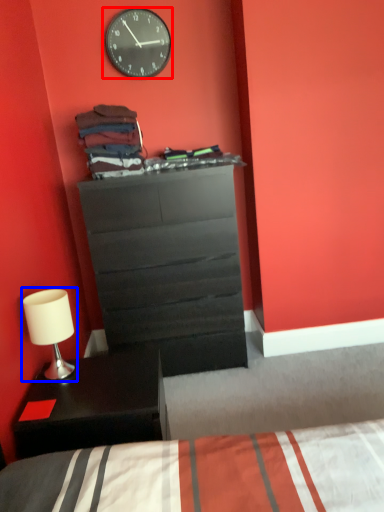
Question: Among these objects, which one is farthest to the camera, wall clock (highlighted by a red box) or table lamp (highlighted by a blue box)?

Choices:
 (A) wall clock
 (B) table lamp

Answer: (A)